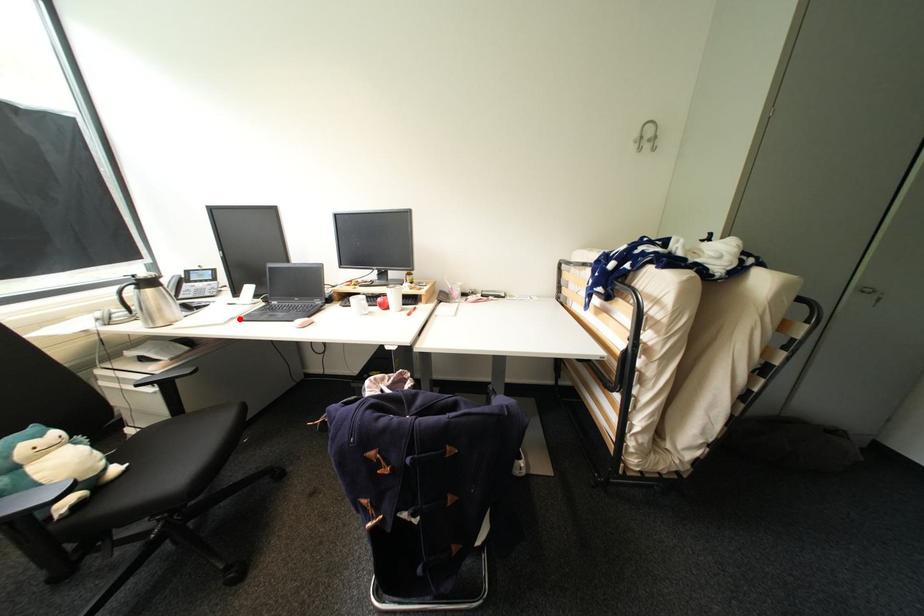
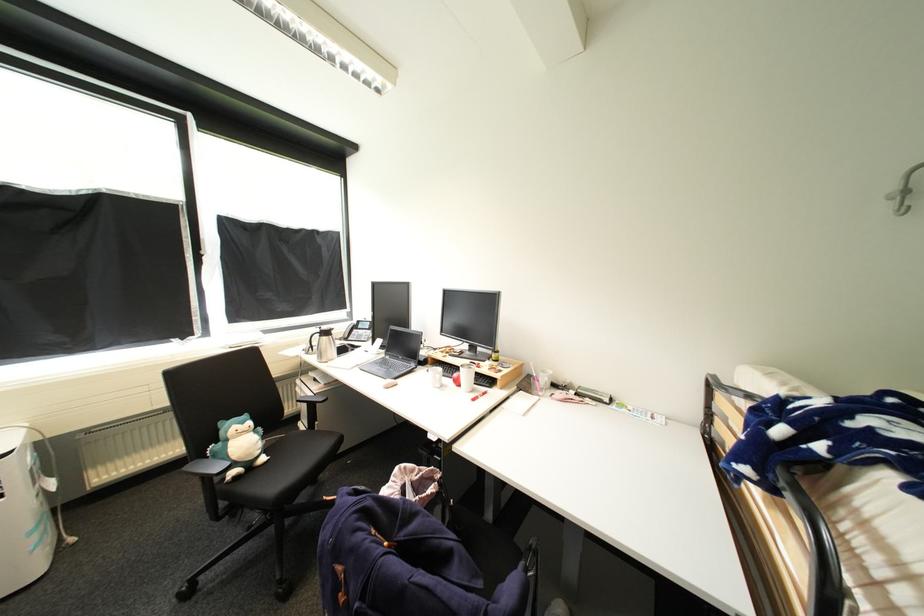
Where in the second image is the point corresponding to the highlighted location from the first image?

(363, 366)